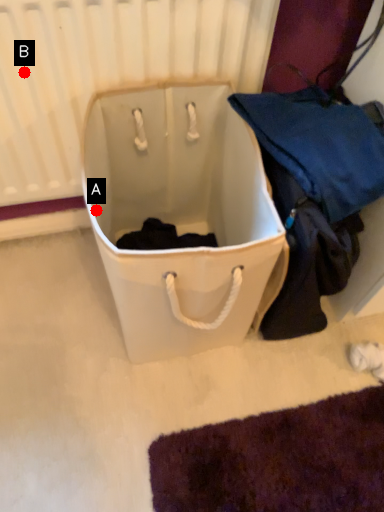
Question: Two points are circled on the image, labeled by A and B beside each circle. Which point is farther from the camera taking this photo?

Choices:
 (A) A is further
 (B) B is further

Answer: (A)